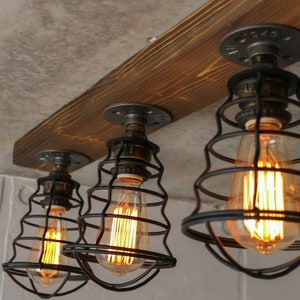
Find the location of a particular element. ceiling is located at coordinates (69, 61).